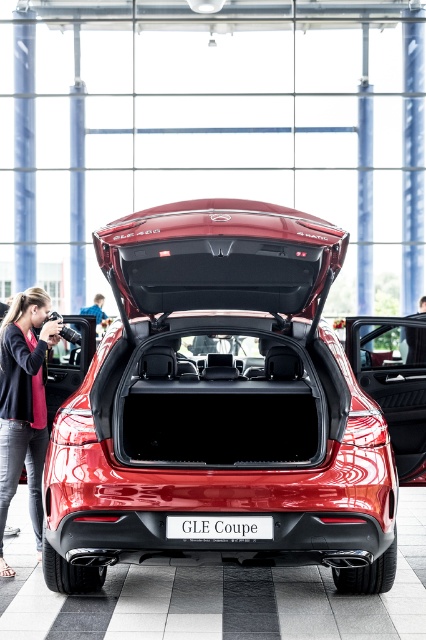
Is glossy metallic car at center bigger than white plastic license plate at center?

Yes.

You are a GUI agent. You are given a task and a screenshot of the screen. Output one action in this format:
    pyautogui.click(x=<x>, y=<y>)
    Task: Click on the glossy metallic car at center
    This screenshot has height=640, width=426.
    Given the screenshot: What is the action you would take?
    pyautogui.click(x=394, y=381)

Where is `glossy metallic car at center`? This screenshot has height=640, width=426. glossy metallic car at center is located at coordinates (394, 381).

Which is more to the left, glossy metallic suv at center or pink fabric jacket at lower left?

pink fabric jacket at lower left is more to the left.

Between glossy metallic suv at center and pink fabric jacket at lower left, which one has more height?

glossy metallic suv at center

Is point (193, 330) positioned in front of point (22, 442)?

That is True.

Locate an element on the screen. This screenshot has width=426, height=640. glossy metallic suv at center is located at coordinates pyautogui.click(x=219, y=404).

Describe the element at coordinates (23, 404) in the screenshot. The height and width of the screenshot is (640, 426). I see `pink fabric jacket at lower left` at that location.

Which of these two, pink fabric jacket at lower left or glossy metallic car at center, stands shorter?

glossy metallic car at center is shorter.

At what (x,y) coordinates should I click in order to perform the action: click on pink fabric jacket at lower left. Please return your answer as a coordinate pair (x, y). The height and width of the screenshot is (640, 426). Looking at the image, I should click on (23, 404).